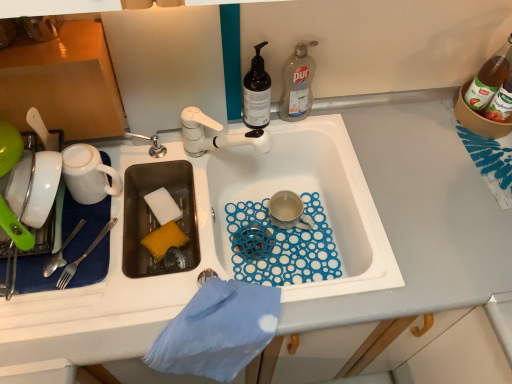
Find the location of `free space in front of satin silver fork at left`. free space in front of satin silver fork at left is located at coordinates (70, 317).